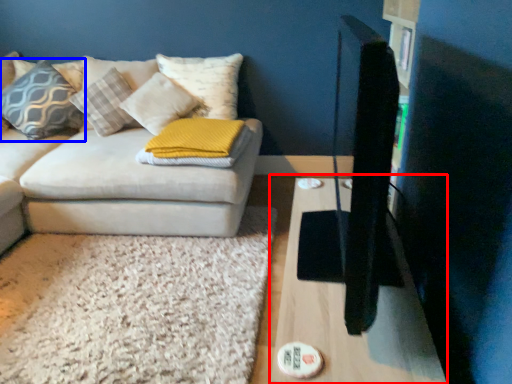
Question: Among these objects, which one is nearest to the camera, table (highlighted by a red box) or pillow (highlighted by a blue box)?

Choices:
 (A) table
 (B) pillow

Answer: (A)